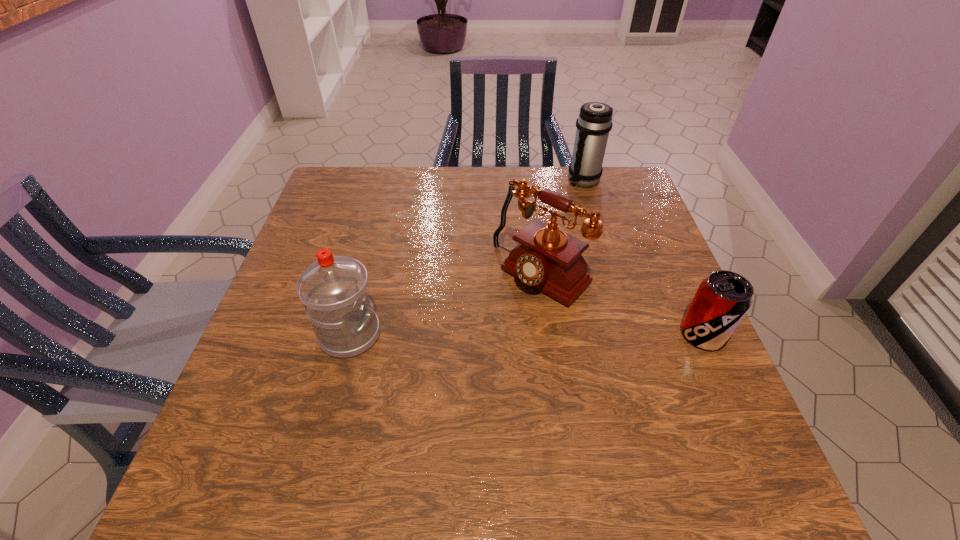
The height and width of the screenshot is (540, 960). Find the location of `vacant space on the desktop that is between the leftmost object and the shortest object and is positioned on the dial of the third object from right to left`. vacant space on the desktop that is between the leftmost object and the shortest object and is positioned on the dial of the third object from right to left is located at coordinates (478, 334).

Where is `free spot on the desktop that is between the water bottle and the rightmost object and is positioned on the side with the handle of the farthest object`? free spot on the desktop that is between the water bottle and the rightmost object and is positioned on the side with the handle of the farthest object is located at coordinates (490, 334).